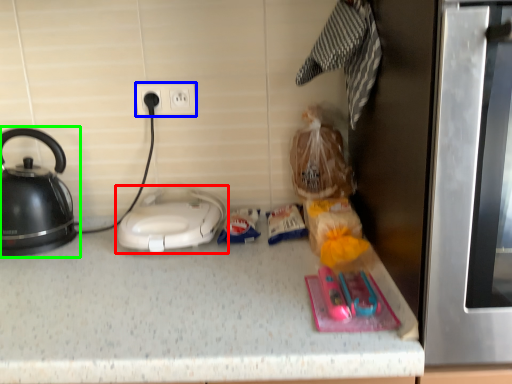
Question: Estimate the real-world distances between objects in this image. Which object is farther from home appliance (highlighted by a red box), electric outlet (highlighted by a blue box) or kettle (highlighted by a green box)?

Choices:
 (A) electric outlet
 (B) kettle

Answer: (A)